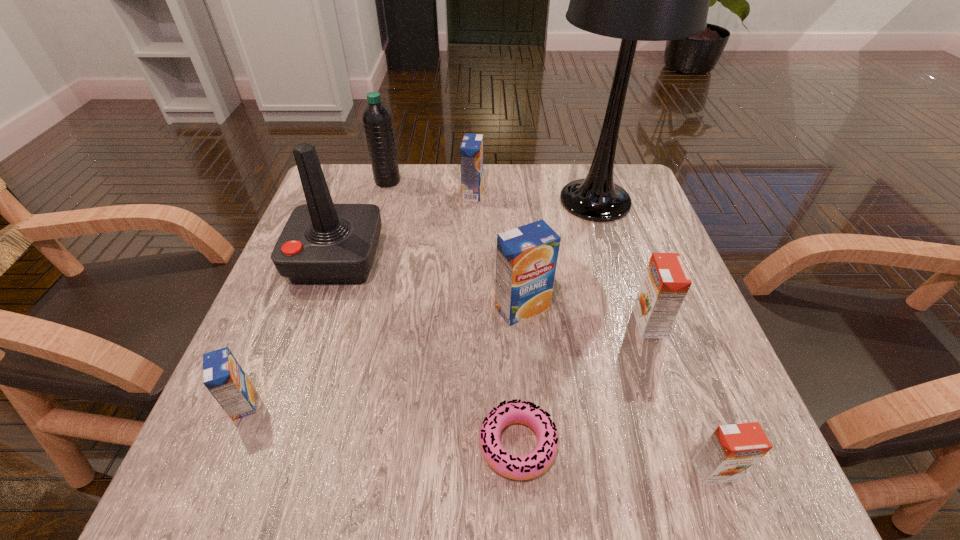
The height and width of the screenshot is (540, 960). Find the location of `vacant region located on the front of the farthest orange juice`. vacant region located on the front of the farthest orange juice is located at coordinates (471, 276).

I want to click on vacant space located on the back of the leftmost orange juice, so click(x=312, y=238).

Where is `free space located on the back of the nearest orange juice`? The width and height of the screenshot is (960, 540). free space located on the back of the nearest orange juice is located at coordinates (676, 365).

In order to click on vacant area located 0.310m on the back of the doughnut in this screenshot , I will do `click(507, 273)`.

At what (x,y) coordinates should I click in order to perform the action: click on table lamp positioned at the far edge. Please return your answer as a coordinate pair (x, y). Looking at the image, I should click on (634, 0).

Identify the location of water bottle that is at the far edge. This screenshot has height=540, width=960. (377, 119).

I want to click on orange_juice located at the far edge, so click(471, 150).

The width and height of the screenshot is (960, 540). In order to click on orange juice present at the near edge in this screenshot , I will do `click(732, 450)`.

At what (x,y) coordinates should I click in order to perform the action: click on doughnut located at the near edge. Please return your answer as a coordinate pair (x, y). This screenshot has height=540, width=960. Looking at the image, I should click on [532, 465].

Find the location of `joystick located in the left edge section of the desktop`. joystick located in the left edge section of the desktop is located at coordinates pos(321,243).